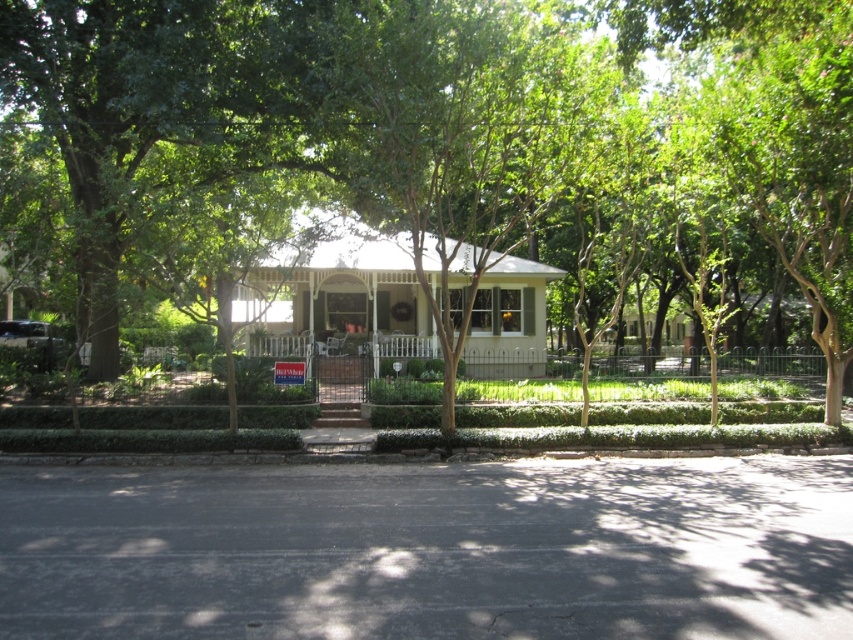
Question: Which point is closer to the camera?

Choices:
 (A) white matte roof at center
 (B) green leafy tree at center

Answer: (B)

Question: Estimate the real-world distances between objects in this image. Which object is farther from the white matte roof at center?

Choices:
 (A) green leafy tree at center
 (B) beige textured gazebo at center

Answer: (A)

Question: Can you confirm if beige textured gazebo at center is positioned to the left of white matte roof at center?

Choices:
 (A) no
 (B) yes

Answer: (B)

Question: Does green leafy tree at center appear on the right side of white matte roof at center?

Choices:
 (A) yes
 (B) no

Answer: (A)

Question: Can you confirm if beige textured gazebo at center is bigger than white matte roof at center?

Choices:
 (A) yes
 (B) no

Answer: (A)

Question: Which object is positioned closest to the beige textured gazebo at center?

Choices:
 (A) green leafy tree at center
 (B) white matte roof at center

Answer: (B)